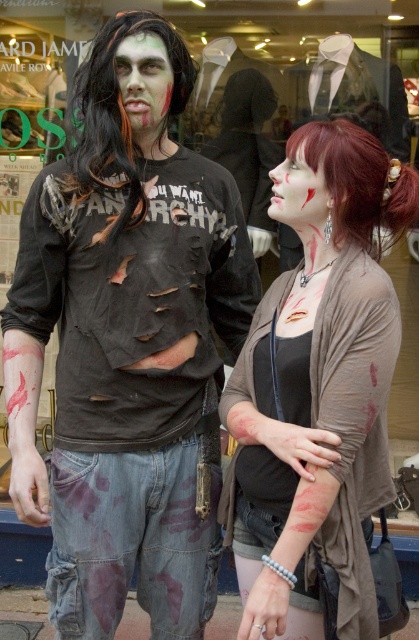
You are a costume designer preparing for a Halloween event. You have a limited space in your display case that can only accommodate items up to 30 cm in width. You need to place both the black synthetic wig at upper left and the matte skin face at center into the case. Based on their widths, can both items fit side by side without overlapping?

The black synthetic wig at upper left might be wider than matte skin face at center. If the wig is wider than 30 cm, then both items cannot fit side by side. However, if the wig is within the 30 cm limit, they could potentially fit. The exact dimensions are uncertain, so further measurement is needed.

You are a customer in a costume shop looking for a zombie wig to complete your Halloween costume. You see two wigs displayed in the window, the black synthetic wig at upper left and the dark brown synthetic wig at upper right. Which wig is positioned to the left side of the other?

The black synthetic wig at upper left is positioned to the left of the dark brown synthetic wig at upper right.

You are a costume designer preparing for a Halloween event. You have two items in front of you, the matte brown cardigan at center and the black synthetic wig at upper left. Which item should you choose if you need the larger one for a big head or a tall costume?

The matte brown cardigan at center has a larger size compared to the black synthetic wig at upper left, so you should choose the matte brown cardigan at center for a big head or tall costume.